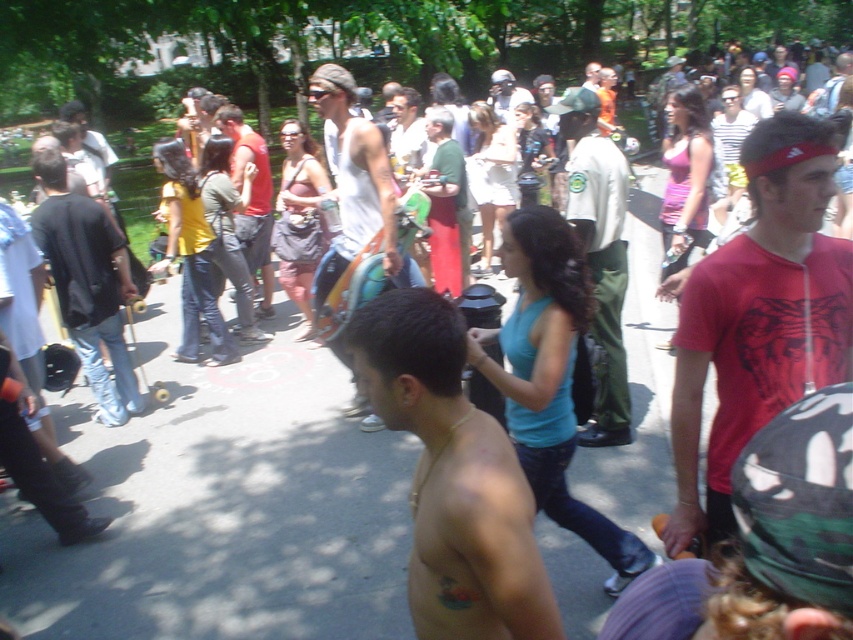
You are organizing a photo shoot and need to position two models wearing the black cotton shirt at left and the matte red tank top at center. The photographer wants them to appear closer in the final image. Based on the scene description, how far apart are the two models currently?

The black cotton shirt at left and the matte red tank top at center are currently 5.41 feet apart.